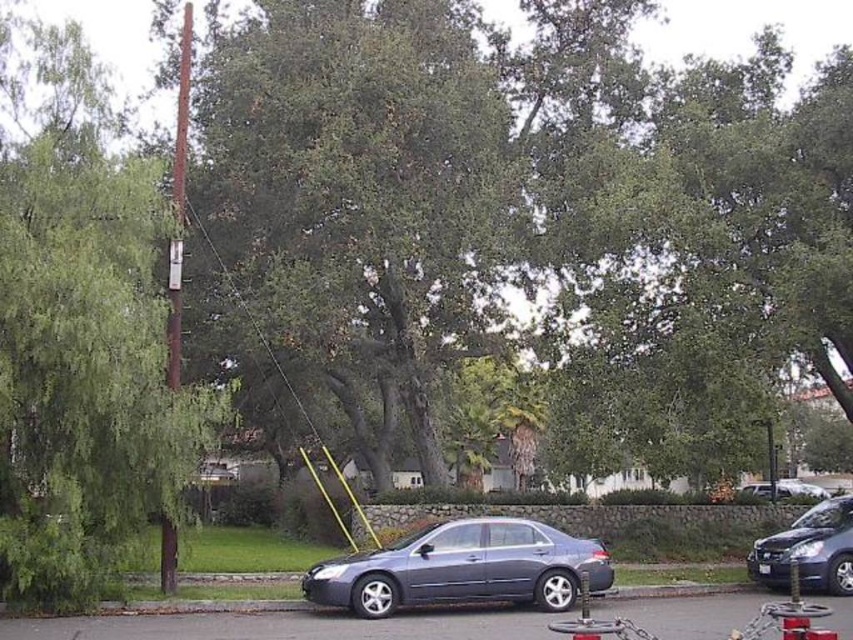
Consider the image. You are driving a car and want to park in the space between the green leafy tree at left and the metallic silver sedan at center. Can you safely park there without hitting either object?

The green leafy tree at left is closer to the viewer than the metallic silver sedan at center, so parking between them may be possible, but you must ensure sufficient space between the car and both objects to avoid collisions.

Based on the photo, you are standing at the point marked by the coordinates point (178, 204). Looking around, you see a large tree dominating the center of the frame and a parked sedan. Which object is closer to your current position?

The brown wooden telegraph pole at left is represented by point (178, 204), so you are standing at the location of the brown wooden telegraph pole at left. Therefore, you are already at that object, so it is the closest to your position.